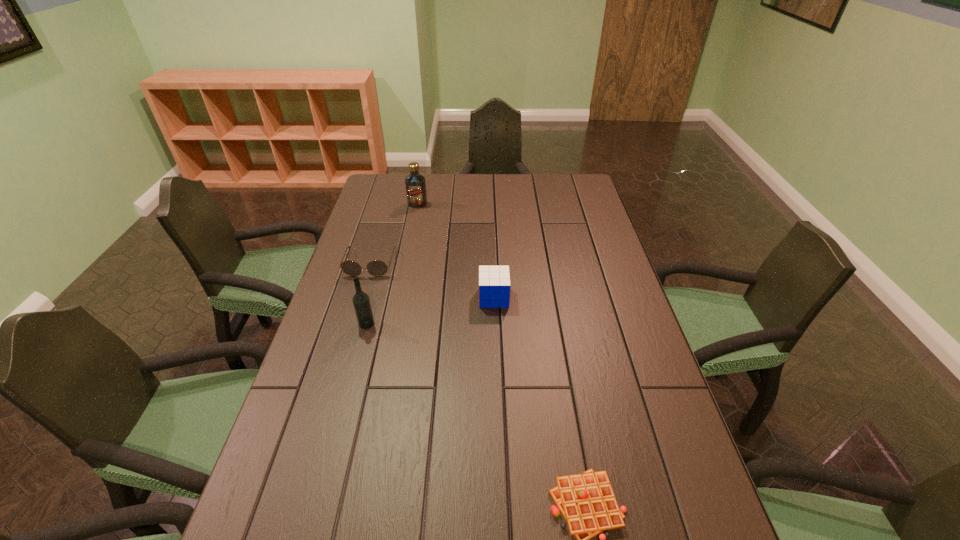
Locate an element on the screen. free space located on the left of the third nearest object is located at coordinates point(388,298).

The image size is (960, 540). What are the coordinates of `free space located 0.340m on the lenses of the fourth nearest object` in the screenshot? It's located at (341, 361).

Identify the location of object that is at the far edge. (415, 183).

Image resolution: width=960 pixels, height=540 pixels. In order to click on vodka that is positioned at the left edge in this screenshot , I will do `click(361, 301)`.

Where is `sunglasses present at the left edge`? sunglasses present at the left edge is located at coordinates (376, 268).

In the image, there is a desktop. Where is `free space at the far edge`? The width and height of the screenshot is (960, 540). free space at the far edge is located at coordinates (457, 178).

The height and width of the screenshot is (540, 960). What are the coordinates of `vacant space at the left edge of the desktop` in the screenshot? It's located at (340, 368).

In the image, there is a desktop. Where is `free space at the right edge`? The image size is (960, 540). free space at the right edge is located at coordinates (600, 372).

The width and height of the screenshot is (960, 540). Find the location of `vacant region at the far left corner of the desktop`. vacant region at the far left corner of the desktop is located at coordinates (381, 178).

Find the location of a particular element. This screenshot has width=960, height=540. vacant area that lies between the nearer vodka and the fourth tallest object is located at coordinates (368, 294).